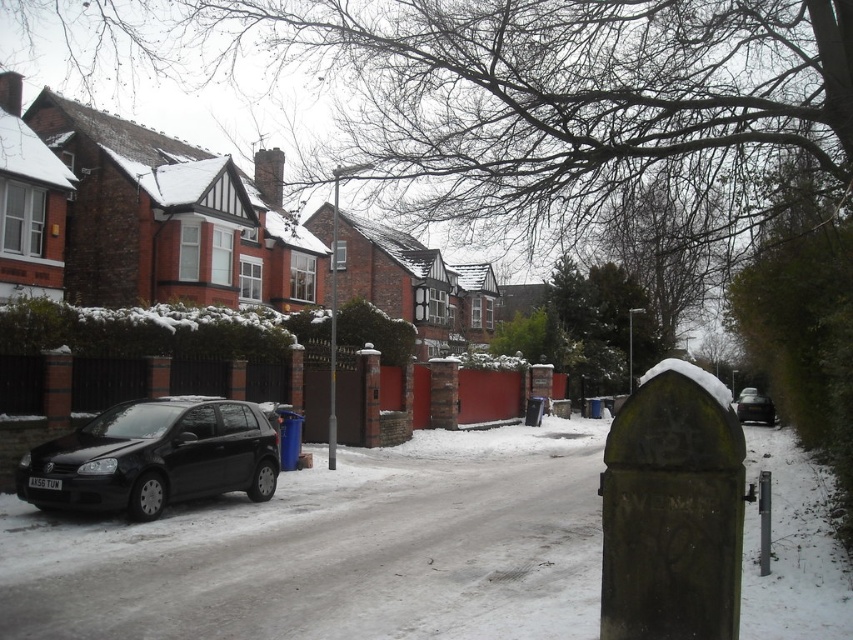
Question: Is matte black car at lower left wider than black matte car at right?

Choices:
 (A) yes
 (B) no

Answer: (B)

Question: Is matte black car at lower left positioned at the back of black matte car at right?

Choices:
 (A) no
 (B) yes

Answer: (A)

Question: Does matte black car at lower left come behind black matte car at right?

Choices:
 (A) no
 (B) yes

Answer: (A)